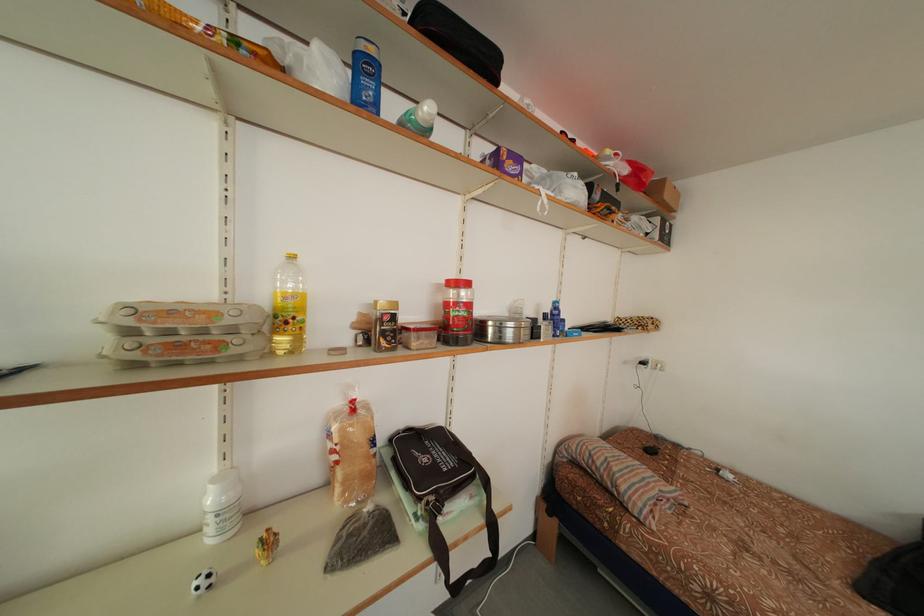
Find the location of `metal container lid`. metal container lid is located at coordinates (502, 329).